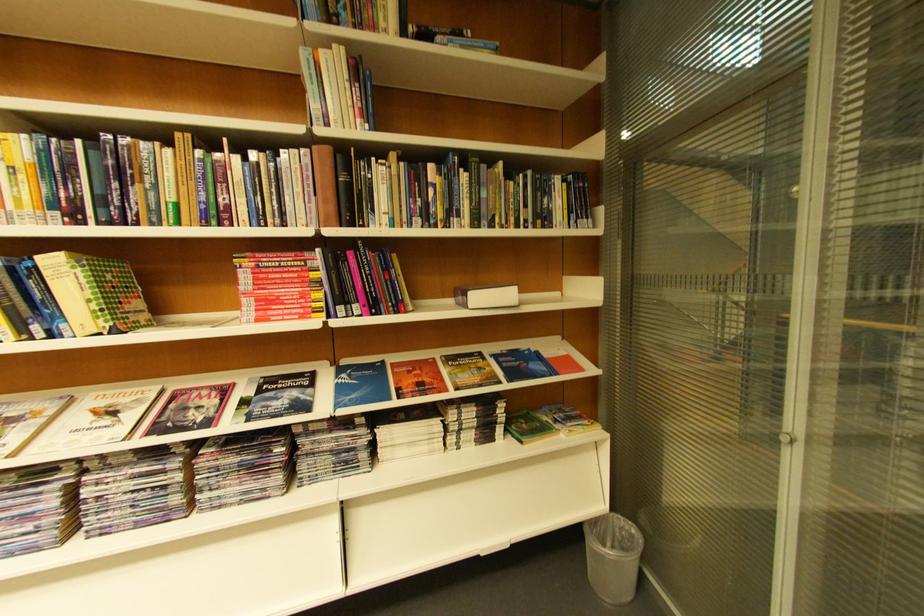
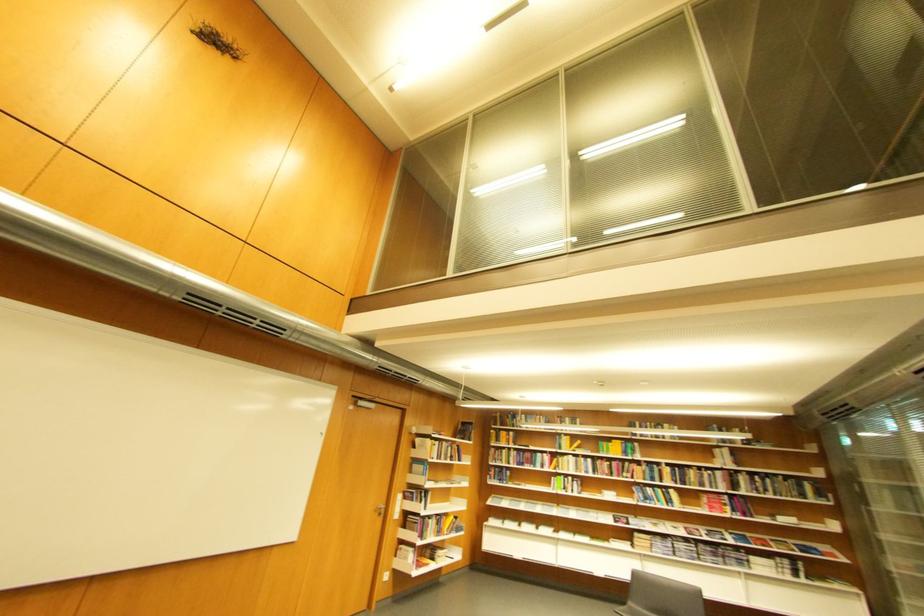
Where in the second image is the point corresponding to point 37,517 from the first image?

(677, 549)